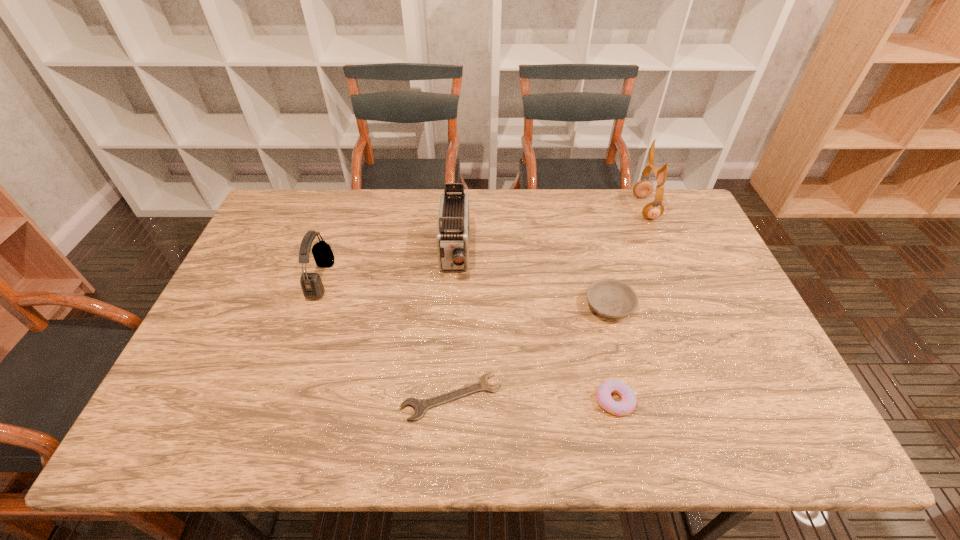
Locate an element on the screen. object that is positioned at the right edge is located at coordinates (644, 188).

Image resolution: width=960 pixels, height=540 pixels. I want to click on object at the far right corner, so click(x=644, y=188).

Locate an element on the screen. The height and width of the screenshot is (540, 960). free location at the far edge of the desktop is located at coordinates (522, 200).

The height and width of the screenshot is (540, 960). I want to click on free space at the near edge of the desktop, so click(x=516, y=417).

In the image, there is a desktop. Identify the location of free space at the left edge. Image resolution: width=960 pixels, height=540 pixels. (267, 275).

In the image, there is a desktop. Where is `vacant space at the far left corner`? The width and height of the screenshot is (960, 540). vacant space at the far left corner is located at coordinates (322, 191).

Find the location of a particular element. The width and height of the screenshot is (960, 540). vacant area at the near left corner is located at coordinates (163, 417).

Where is `free region at the far right corner`? This screenshot has width=960, height=540. free region at the far right corner is located at coordinates (674, 218).

Identify the location of free spot between the camcorder and the earphone. (550, 231).

Identify the location of free space between the fourth shortest object and the rightmost object. The height and width of the screenshot is (540, 960). (483, 244).